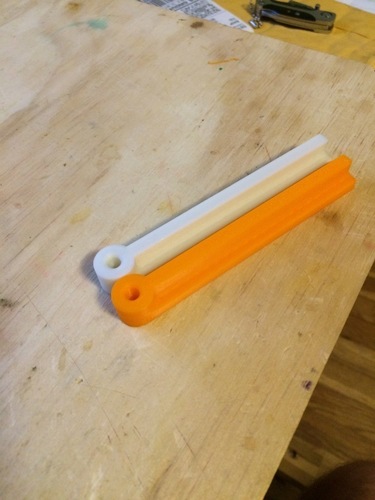
Find the location of a particular element. The height and width of the screenshot is (500, 375). wooden floor is located at coordinates (323, 444), (336, 396), (354, 441), (295, 484), (353, 354), (363, 314).